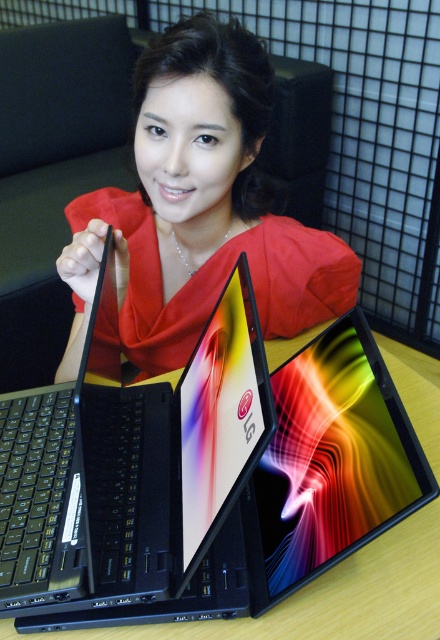
Is black matte laptop at center below matte red dress at center?

Yes.

Is point (17, 433) positioned in front of point (315, 285)?

That is True.

Where is `black matte laptop at center`? This screenshot has width=440, height=640. black matte laptop at center is located at coordinates (129, 467).

Describe the element at coordinates (129, 467) in the screenshot. I see `black matte laptop at center` at that location.

Is black matte laptop at center wider than matte black tablet at center?

Correct, the width of black matte laptop at center exceeds that of matte black tablet at center.

At what (x,y) coordinates should I click in order to perform the action: click on black matte laptop at center. Please return your answer as a coordinate pair (x, y). This screenshot has height=640, width=440. Looking at the image, I should click on (129, 467).

Does matte red dress at center have a lesser width compared to matte black tablet at center?

Incorrect, matte red dress at center's width is not less than matte black tablet at center's.

Does matte red dress at center appear over matte black tablet at center?

Correct, matte red dress at center is located above matte black tablet at center.

Describe the element at coordinates (198, 209) in the screenshot. The image size is (440, 640). I see `matte red dress at center` at that location.

You are a GUI agent. You are given a task and a screenshot of the screen. Output one action in this format:
    pyautogui.click(x=<x>, y=<y>)
    Task: Click on the matte red dress at center
    
    Given the screenshot: What is the action you would take?
    pyautogui.click(x=198, y=209)